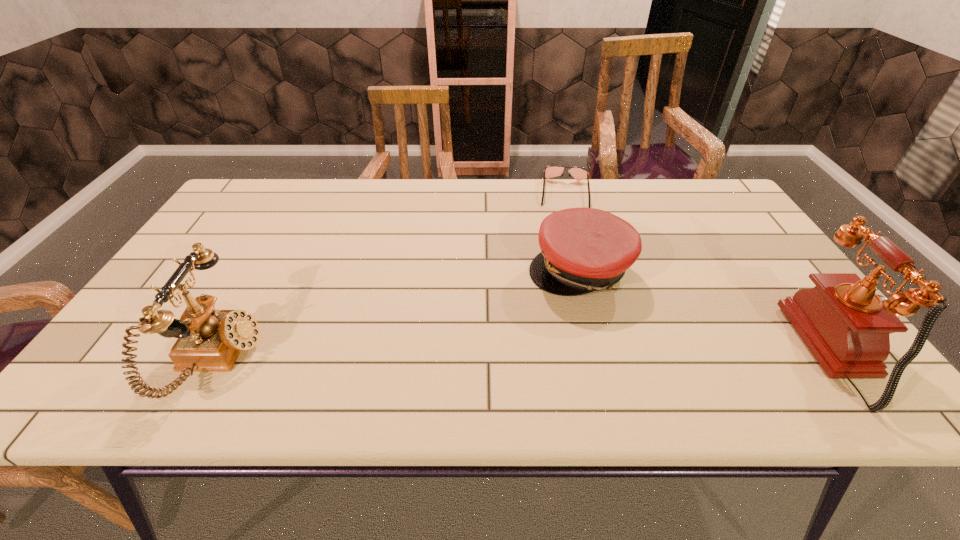
Where is `free space on the desktop that is between the leftmost object and the rightmost object and is positioned on the front-facing side of the cap`? This screenshot has height=540, width=960. free space on the desktop that is between the leftmost object and the rightmost object and is positioned on the front-facing side of the cap is located at coordinates (543, 356).

Identify the location of free space on the desktop that is between the second tallest object and the rightmost object and is positioned on the bridge of the sunglasses. The image size is (960, 540). (566, 356).